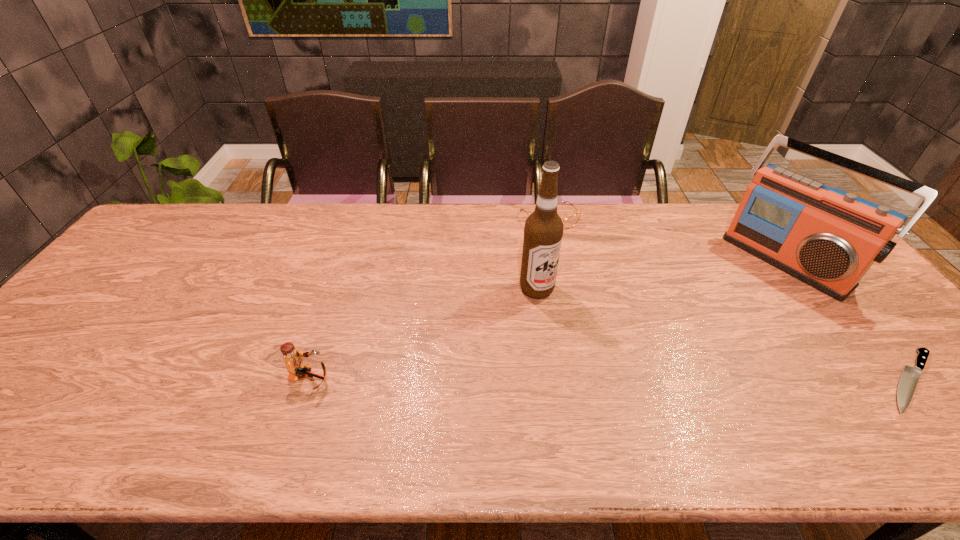
In the image, there is a desktop. At what (x,y) coordinates should I click in order to perform the action: click on vacant region at the far edge. Please return your answer as a coordinate pair (x, y). This screenshot has height=540, width=960. Looking at the image, I should click on (306, 239).

In the image, there is a desktop. At what (x,y) coordinates should I click in order to perform the action: click on free region at the near edge. Please return your answer as a coordinate pair (x, y). Looking at the image, I should click on (177, 413).

Find the location of a particular element. This screenshot has height=540, width=960. vacant region at the far left corner of the desktop is located at coordinates (163, 233).

Locate an element on the screen. Image resolution: width=960 pixels, height=540 pixels. free spot between the tallest object and the radio receiver is located at coordinates (661, 274).

The image size is (960, 540). I want to click on vacant space that's between the radio receiver and the leftmost object, so click(x=548, y=319).

Find the location of a particular element. unoccupied position between the Lego and the second shortest object is located at coordinates (430, 299).

The width and height of the screenshot is (960, 540). Identify the location of empty space between the tallest object and the leftmost object. tap(423, 334).

In order to click on vacant point located between the second tallest object and the spectacles in this screenshot , I will do `click(668, 239)`.

Where is `vacant area between the alcohol and the Lego`? vacant area between the alcohol and the Lego is located at coordinates (423, 334).

Locate which object is the closest to the shortest object. Please provide its 2D coordinates. Your answer should be formatted as a tuple, i.e. [(x, y)], where the tuple contains the x and y coordinates of a point satisfying the conditions above.

[(828, 238)]